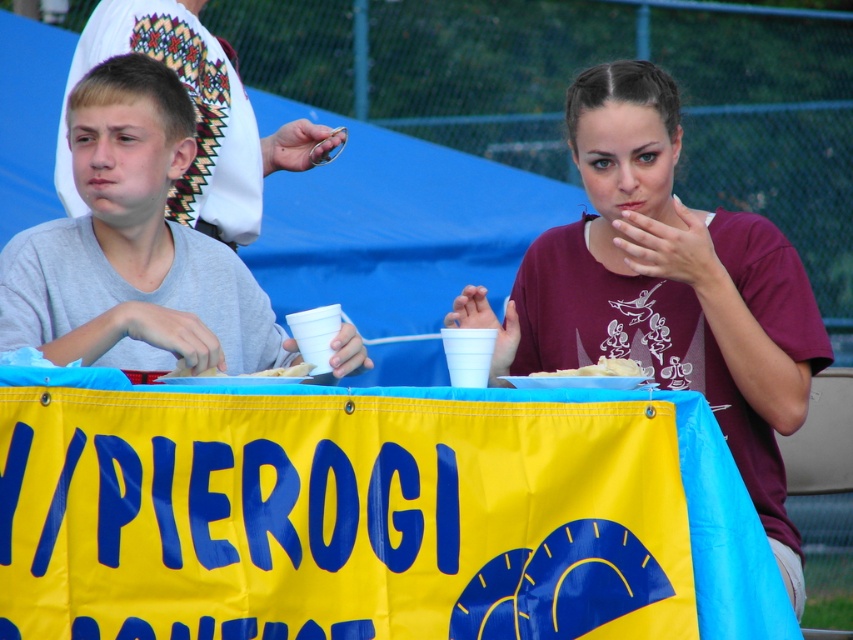
Which is above, yellow fabric banner at center or maroon t-shirt at center?

Positioned higher is maroon t-shirt at center.

This screenshot has width=853, height=640. What do you see at coordinates (370, 513) in the screenshot?
I see `yellow fabric banner at center` at bounding box center [370, 513].

Who is more forward, (666,595) or (631,172)?

Point (666,595) is more forward.

Identify the location of yellow fabric banner at center. (370, 513).

Can you confirm if white matte food at center is thinner than white dough at center?

Yes, white matte food at center is thinner than white dough at center.

Does white matte food at center have a greater width compared to white dough at center?

Incorrect, white matte food at center's width does not surpass white dough at center's.

Image resolution: width=853 pixels, height=640 pixels. I want to click on white matte food at center, so click(x=599, y=369).

Between yellow fabric banner at center and gray matte shirt at left, which one is positioned higher?

Positioned higher is gray matte shirt at left.

Is point (396, 481) positioned behind point (4, 314)?

No, it is not.

I want to click on yellow fabric banner at center, so pos(370,513).